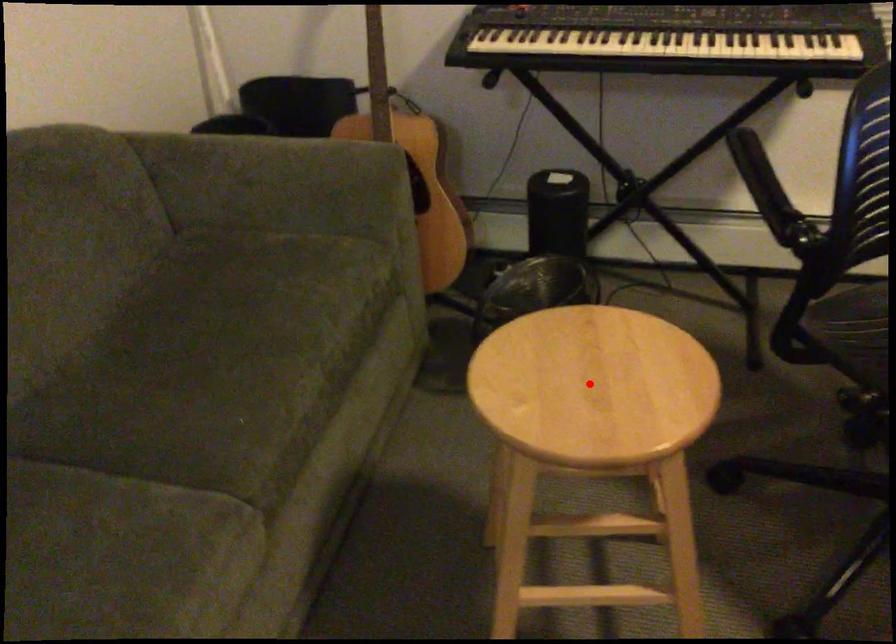
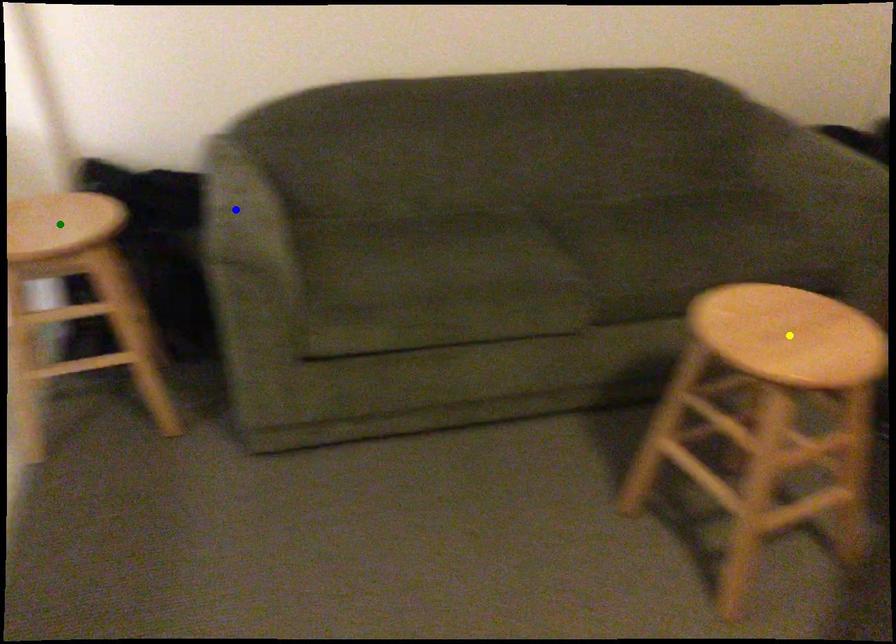
Question: I am providing you with two images of the same scene from different viewpoints. A red point is marked on the first image. You are given multiple points on the second image. Which mark in image 2 goes with the point in image 1?

Choices:
 (A) green point
 (B) blue point
 (C) yellow point

Answer: (C)